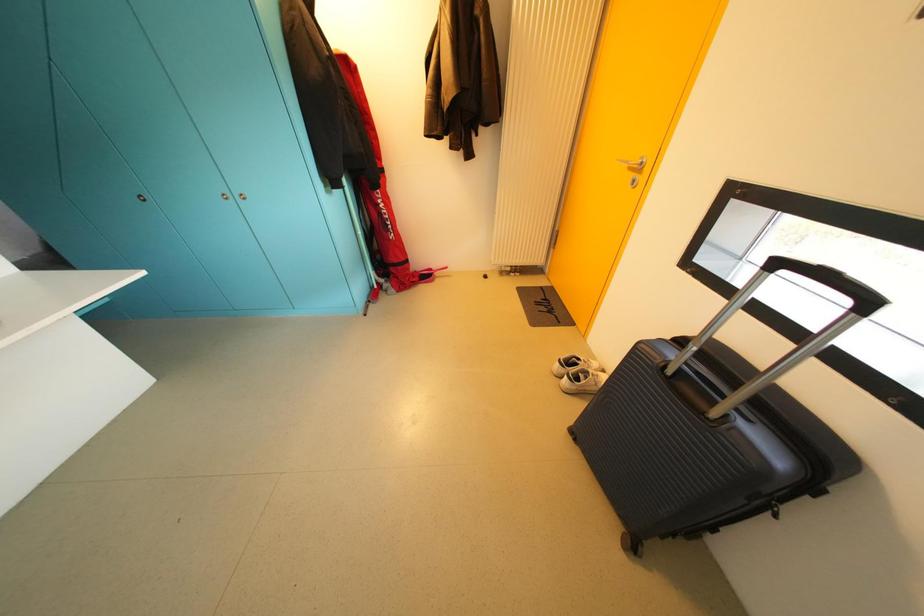
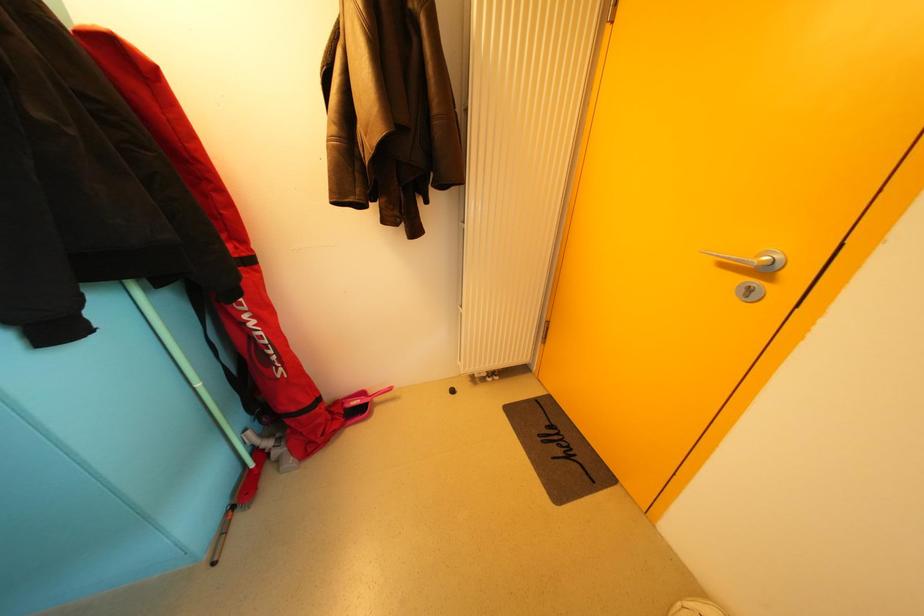
Question: What movement of the cameraman would produce the second image?

Choices:
 (A) Left
 (B) Right
 (C) Forward
 (D) Backward

Answer: (C)